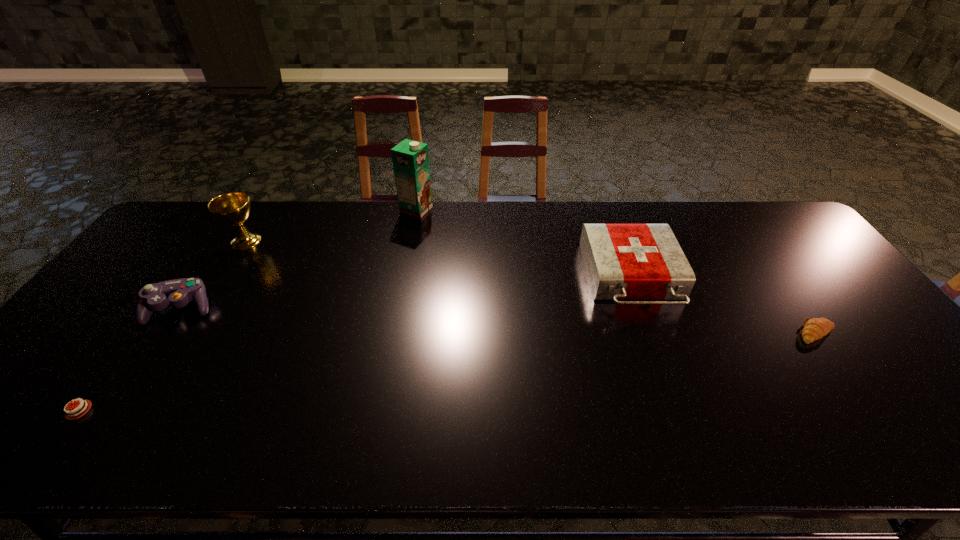
Where is `free point between the nearest object and the second object from right to left`? The height and width of the screenshot is (540, 960). free point between the nearest object and the second object from right to left is located at coordinates (355, 344).

The height and width of the screenshot is (540, 960). Identify the location of vacant region between the nearest object and the control. (130, 360).

Find the location of a particular element. The width and height of the screenshot is (960, 540). vacant space that is in between the second tallest object and the farthest object is located at coordinates (331, 225).

Where is `free spot between the farthest object and the control`? The width and height of the screenshot is (960, 540). free spot between the farthest object and the control is located at coordinates (299, 259).

The width and height of the screenshot is (960, 540). Identify the location of free space between the rightmost object and the first-aid kit. (725, 306).

In order to click on vacant space that is in between the tallest object and the control in this screenshot , I will do [299, 259].

The image size is (960, 540). I want to click on object that stands as the closest to the first-aid kit, so [814, 329].

Locate which object is the fourth closest to the fourth object from left to right. Please provide its 2D coordinates. Your answer should be formatted as a tuple, i.e. [(x, y)], where the tuple contains the x and y coordinates of a point satisfying the conditions above.

[(70, 415)]

Locate an element on the screen. Image resolution: width=960 pixels, height=540 pixels. vacant space that satisfies the following two spatial constraints: 1. on the front side of the first-aid kit; 2. on the right side of the fifth tallest object is located at coordinates (652, 333).

Where is `free space that satisfies the following two spatial constraints: 1. on the back side of the third object from right to left; 2. on the left side of the nearest object`? This screenshot has height=540, width=960. free space that satisfies the following two spatial constraints: 1. on the back side of the third object from right to left; 2. on the left side of the nearest object is located at coordinates (227, 210).